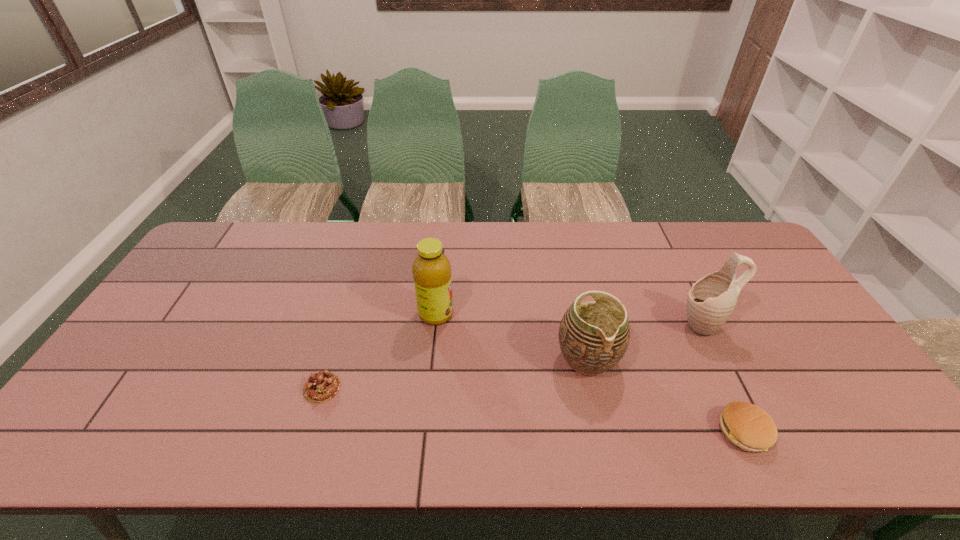
Locate which object ranks third in proximity to the leftmost object. Please provide its 2D coordinates. Your answer should be formatted as a tuple, i.e. [(x, y)], where the tuple contains the x and y coordinates of a point satisfying the conditions above.

[(749, 427)]

Where is `free space that satisfies the following two spatial constraints: 1. on the front side of the leftmost object; 2. on the left side of the nearest object`? This screenshot has width=960, height=540. free space that satisfies the following two spatial constraints: 1. on the front side of the leftmost object; 2. on the left side of the nearest object is located at coordinates (308, 431).

This screenshot has height=540, width=960. I want to click on vacant area that satisfies the following two spatial constraints: 1. on the back side of the third object from left to right; 2. on the right side of the shortest object, so click(331, 359).

Locate an element on the screen. The image size is (960, 540). free space that satisfies the following two spatial constraints: 1. on the front label of the fruit juice; 2. on the left side of the patty is located at coordinates (424, 431).

Where is `free space that satisfies the following two spatial constraints: 1. at the spout of the pitcher; 2. on the front side of the third tallest object`? This screenshot has width=960, height=540. free space that satisfies the following two spatial constraints: 1. at the spout of the pitcher; 2. on the front side of the third tallest object is located at coordinates [719, 359].

Where is `free spot that satisfies the following two spatial constraints: 1. on the back side of the patty; 2. on the front label of the fourth object from right to left`? This screenshot has height=540, width=960. free spot that satisfies the following two spatial constraints: 1. on the back side of the patty; 2. on the front label of the fourth object from right to left is located at coordinates (688, 314).